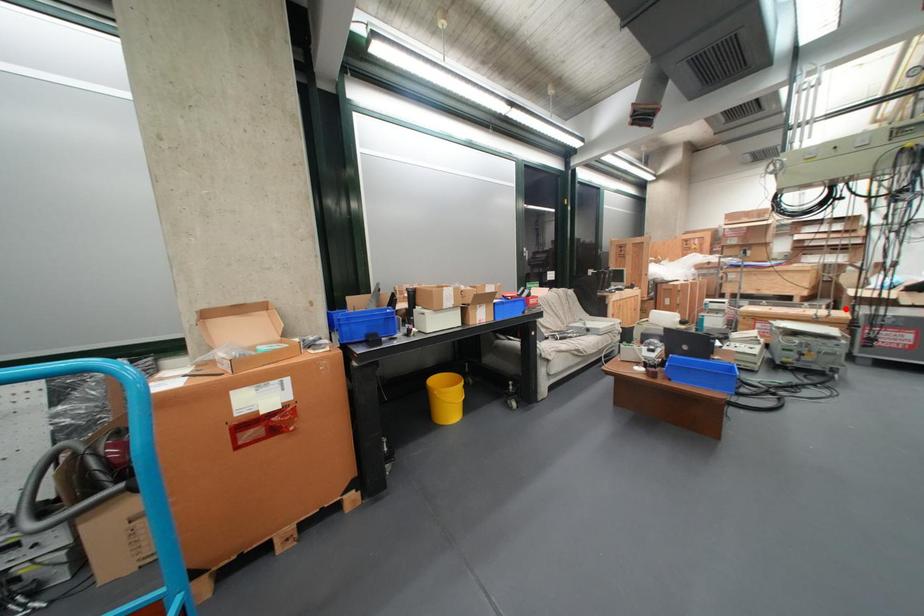
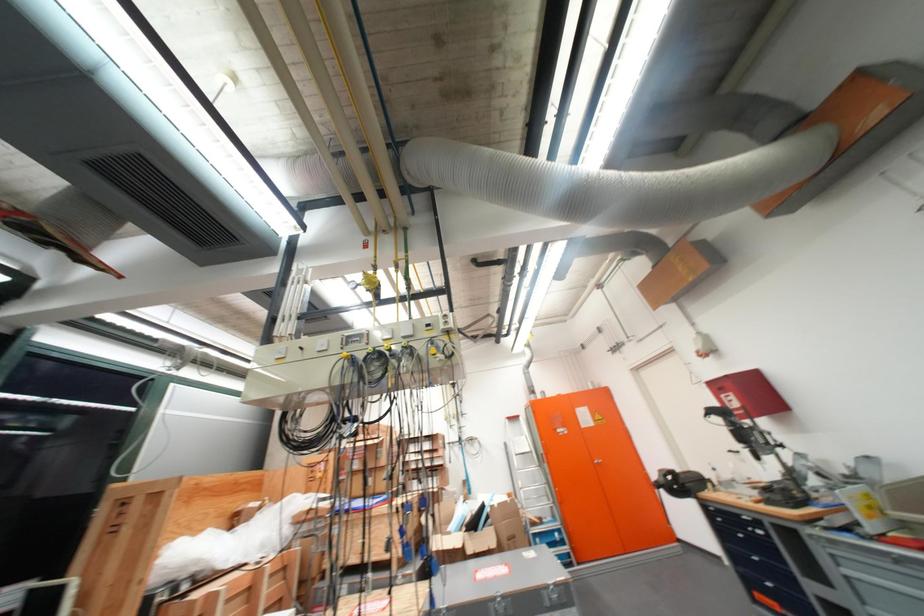
Where in the second image is the point corresponding to the highlighted location from the first image?

(438, 573)